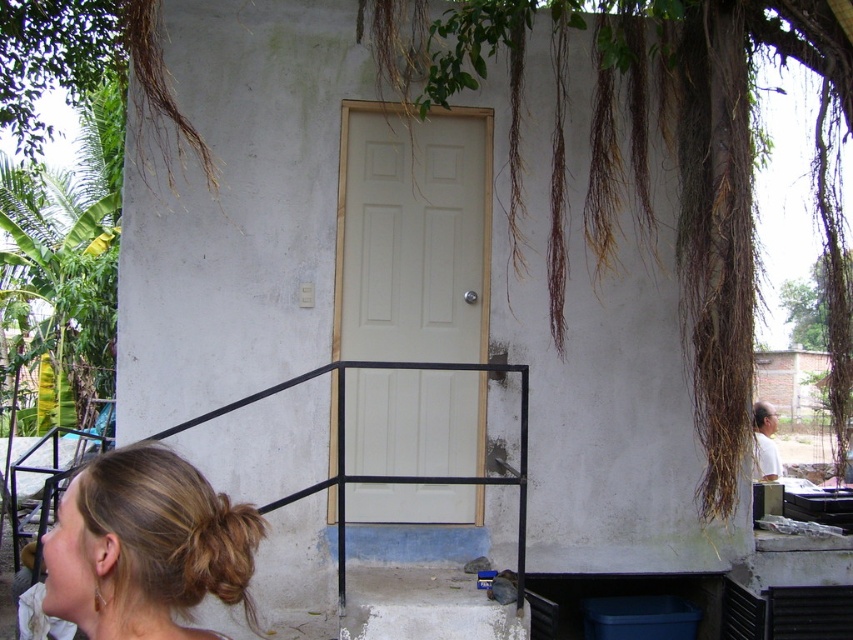
You are standing in front of the building and want to reach the door. There is a black metal rail at lower center and a brown fuzzy hair at lower left. Which object is taller?

The black metal rail at lower center is much taller than the brown fuzzy hair at lower left.

You are standing in front of the building and notice two figures nearby. One is a brown fuzzy hair at lower left and the other is a white matte man at right. Which figure appears shorter?

The brown fuzzy hair at lower left has a lesser height compared to the white matte man at right, so the brown fuzzy hair at lower left appears shorter.

You are standing in front of the building and want to reach the door. The black metal rail at lower center is in your way. Can you walk around it to get to the door?

The black metal rail at lower center is 3.55 meters away from viewer, so you can walk around it to reach the door.